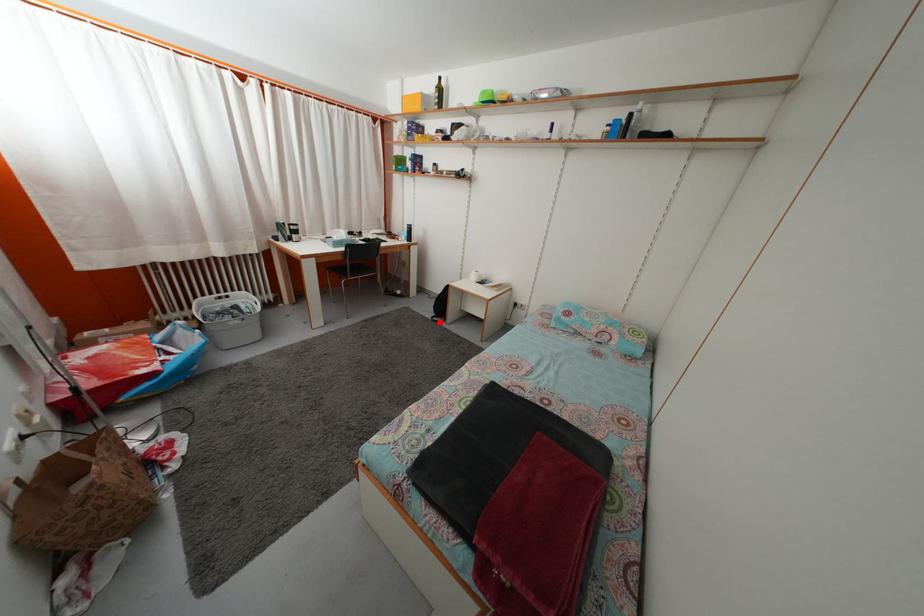
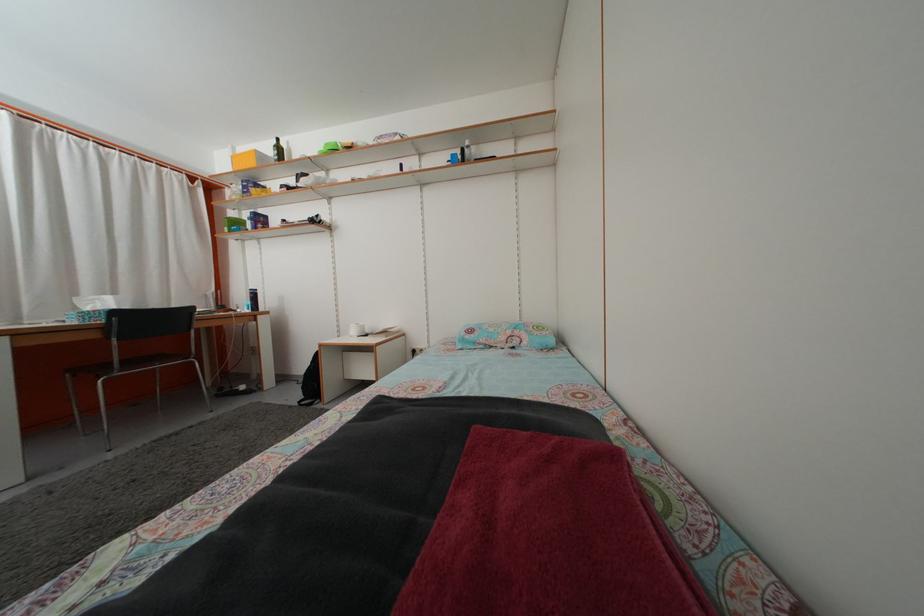
Find the pixel in the second image that matches the highlighted location in the first image.

(309, 405)